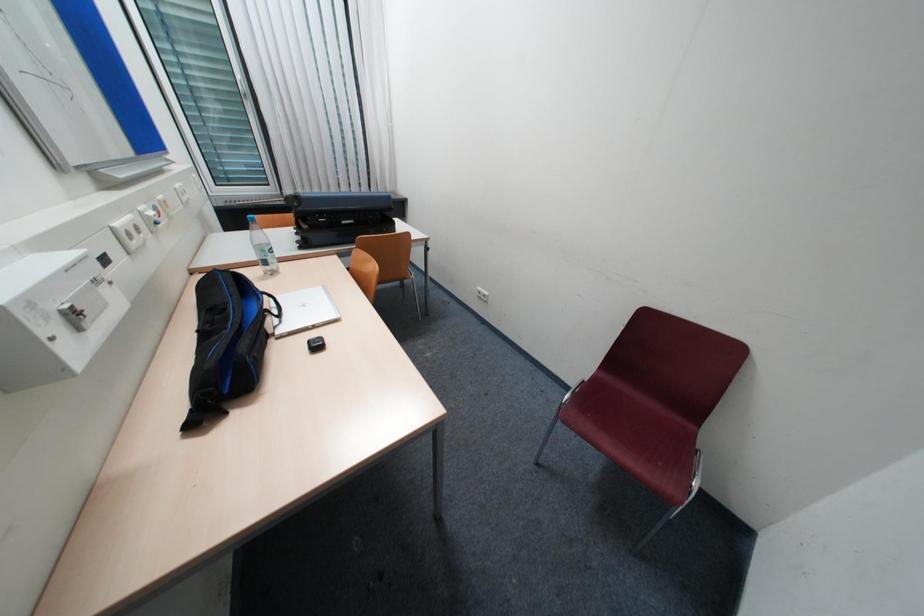
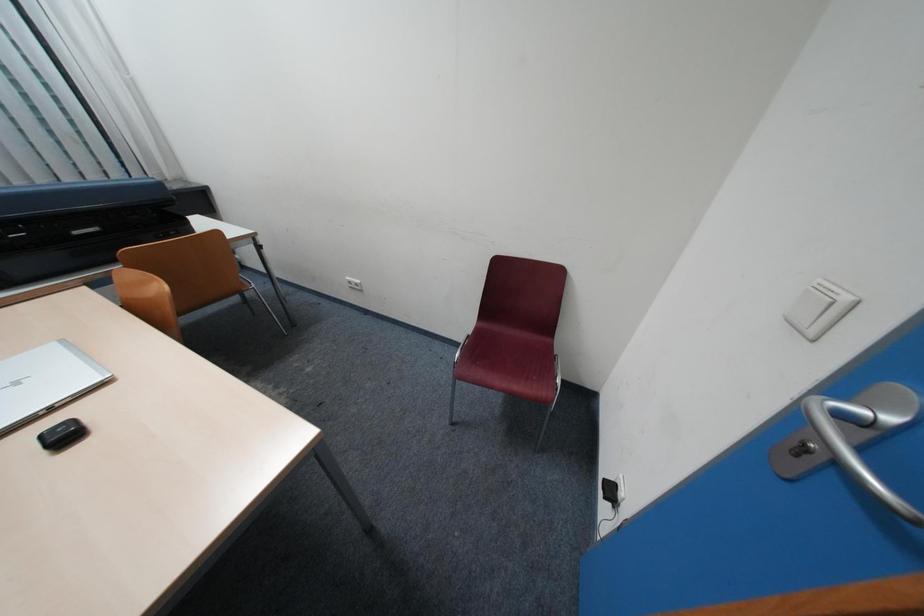
Question: The camera is either moving clockwise (left) or counter-clockwise (right) around the object. The first image is from the beginning of the video and the second image is from the end. Is the camera moving left or right when shooting the video?

Choices:
 (A) Left
 (B) Right

Answer: (A)